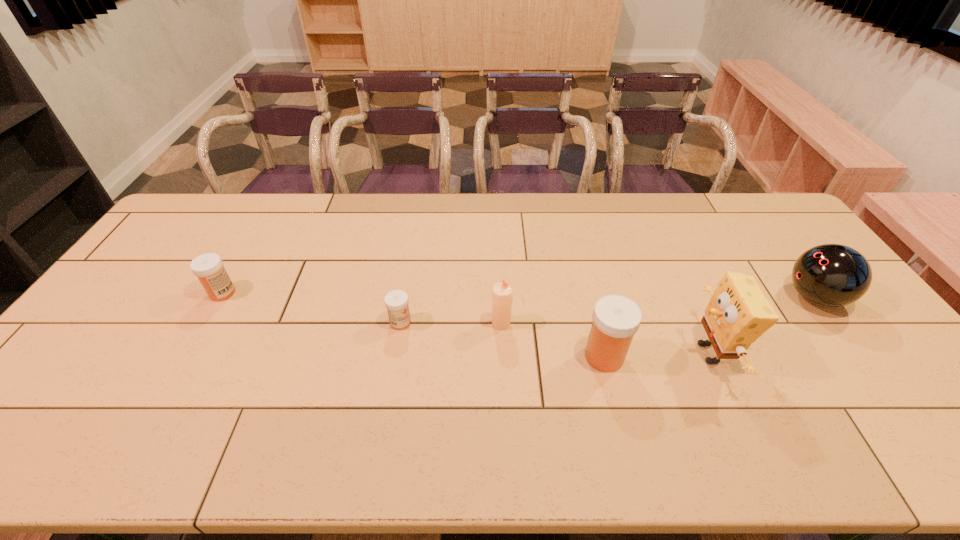
Where is `object that is at the near edge`? The width and height of the screenshot is (960, 540). object that is at the near edge is located at coordinates (737, 314).

Locate an element on the screen. object that is at the right edge is located at coordinates (830, 275).

Locate an element on the screen. This screenshot has height=540, width=960. vacant area at the far edge of the desktop is located at coordinates (291, 203).

This screenshot has height=540, width=960. Identify the location of vacant position at the near edge of the desktop. (763, 396).

In the image, there is a desktop. Identify the location of vacant space at the left edge. (137, 303).

Find the location of `free location at the right edge`. free location at the right edge is located at coordinates (789, 286).

What are the coordinates of `free space between the rightmost medicine and the fifth object from right to left` in the screenshot? It's located at (502, 340).

You are a GUI agent. You are given a task and a screenshot of the screen. Output one action in this format:
    pyautogui.click(x=<x>, y=<y>)
    Task: Click on the free point between the third object from right to left and the fourth object from right to left
    Image resolution: width=960 pixels, height=540 pixels.
    Given the screenshot: What is the action you would take?
    pyautogui.click(x=553, y=340)

The width and height of the screenshot is (960, 540). In order to click on unoccupied position between the sponge and the third object from right to left in this screenshot , I will do `click(657, 355)`.

Where is `free area in between the tallest object and the leftmost medicine`? This screenshot has width=960, height=540. free area in between the tallest object and the leftmost medicine is located at coordinates (466, 323).